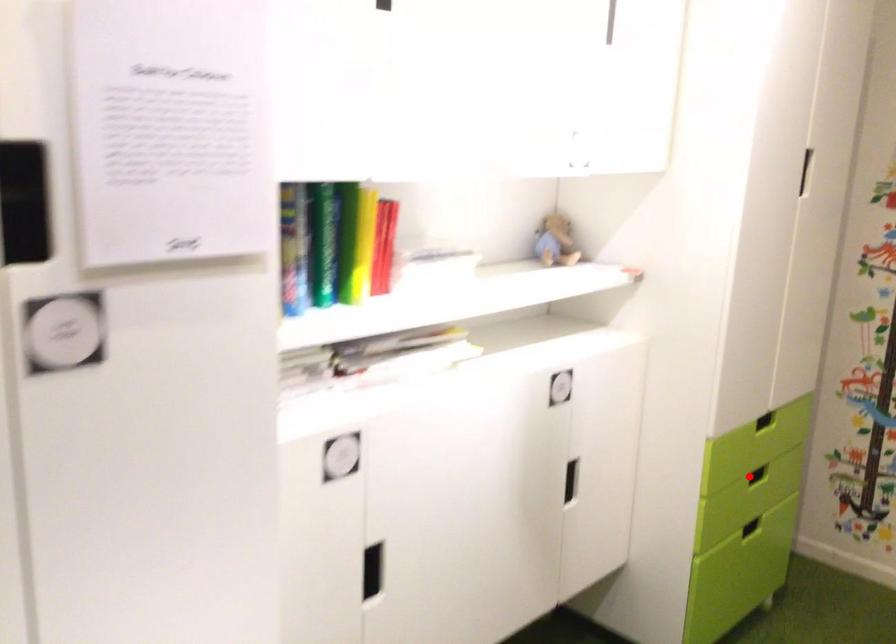
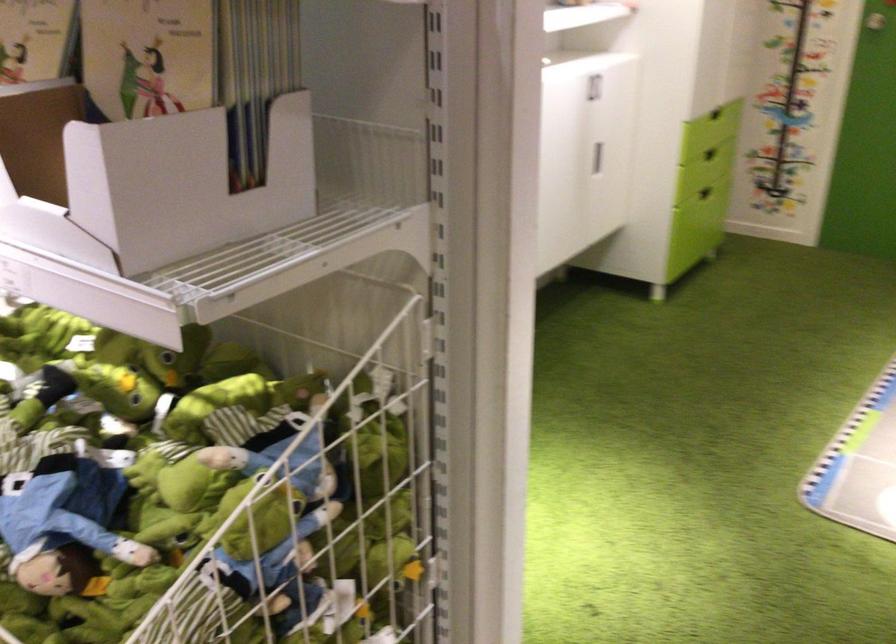
Find the pixel in the second image that matches the highlighted location in the first image.

(710, 154)